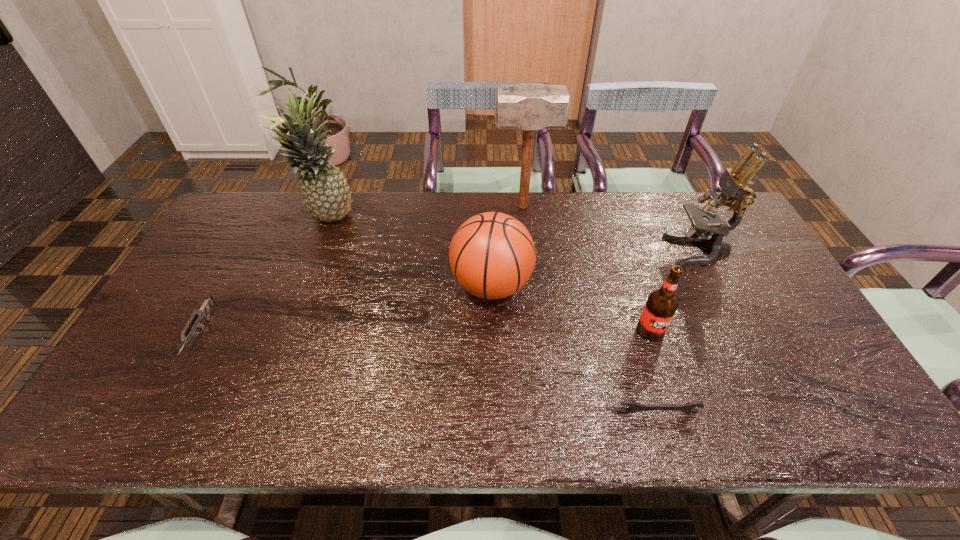
Where is `the closest object to the basketball`? the closest object to the basketball is located at coordinates (528, 106).

Locate an element on the screen. The width and height of the screenshot is (960, 540). blank area in the image that satisfies the following two spatial constraints: 1. at the eyepieces of the microscope; 2. aimed along the barrel of the leftmost object is located at coordinates (741, 334).

You are a GUI agent. You are given a task and a screenshot of the screen. Output one action in this format:
    pyautogui.click(x=<x>, y=<y>)
    Task: Click on the free region that satisfies the following two spatial constraints: 1. at the eyepieces of the rightmost object; 2. on the open ends of the wrench
    The height and width of the screenshot is (540, 960).
    Given the screenshot: What is the action you would take?
    pyautogui.click(x=780, y=413)

Find the location of a particular element. free space that satisfies the following two spatial constraints: 1. at the eyepieces of the rightmost object; 2. aimed along the barrel of the leftmost object is located at coordinates (741, 334).

Where is `vacant point that satisfies the following two spatial constraints: 1. on the striking face of the mallet; 2. aimed along the barrel of the leftmost object`? vacant point that satisfies the following two spatial constraints: 1. on the striking face of the mallet; 2. aimed along the barrel of the leftmost object is located at coordinates (537, 334).